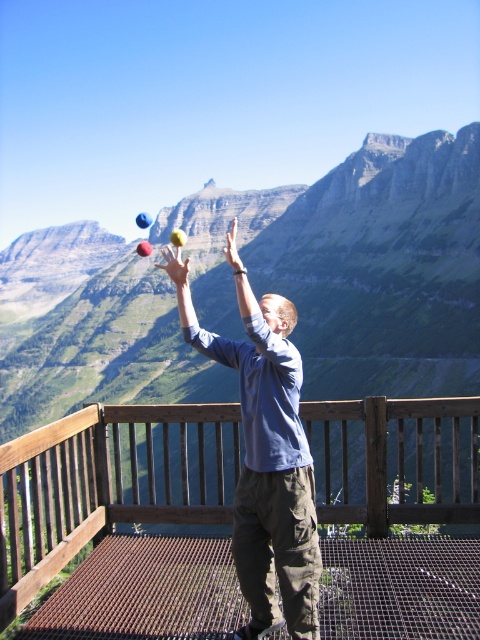
Question: Which of the following is the farthest from the observer?

Choices:
 (A) (294, 468)
 (B) (285, 227)

Answer: (B)

Question: Which point is farther from the camera taking this photo?

Choices:
 (A) (144, 218)
 (B) (87, 513)
 (C) (200, 262)
 (D) (288, 310)

Answer: (C)

Question: Does green grassy mountain at upper center appear on the right side of rubber ball at upper center?

Choices:
 (A) no
 (B) yes

Answer: (B)

Question: Is green grassy mountain at upper center wider than blue fabric shirt at center?

Choices:
 (A) no
 (B) yes

Answer: (B)

Question: From the image, what is the correct spatial relationship of brown wooden balustrade at center in relation to rubber ball at upper center?

Choices:
 (A) above
 (B) below

Answer: (B)

Question: Which object is closer to the camera taking this photo?

Choices:
 (A) rubber ball at upper center
 (B) brown wooden balustrade at center
 (C) blue fabric shirt at center

Answer: (C)